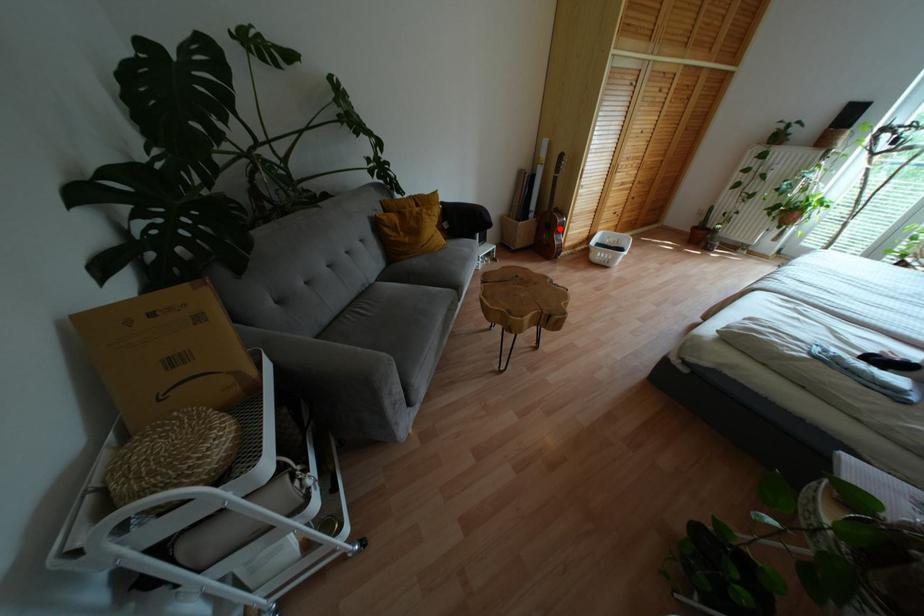
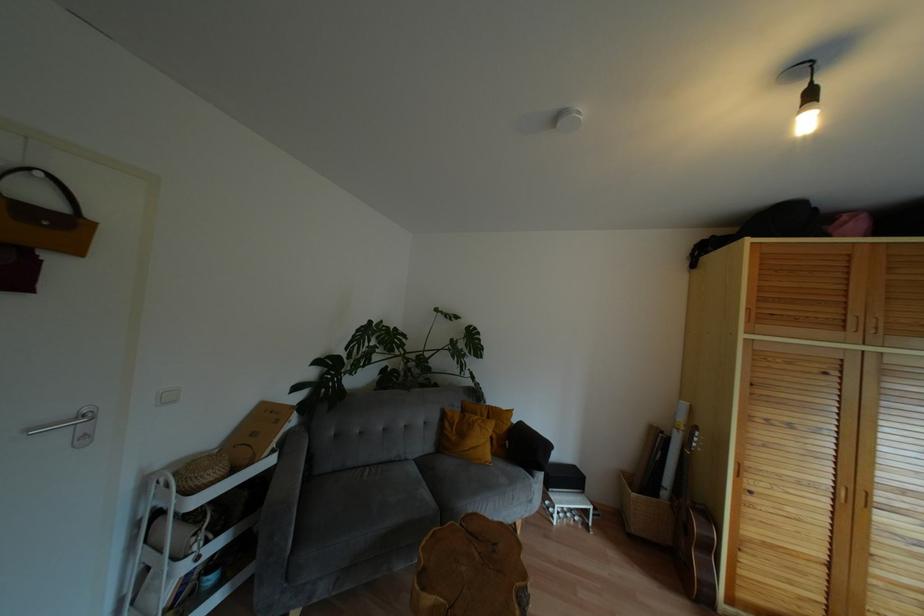
Question: A red point is marked in image1. In image2, is the corresponding 3D point closer to the camera or farther? Reply with the corresponding letter.

Choices:
 (A) The corresponding 3D point is closer.
 (B) The corresponding 3D point is farther.

Answer: (B)